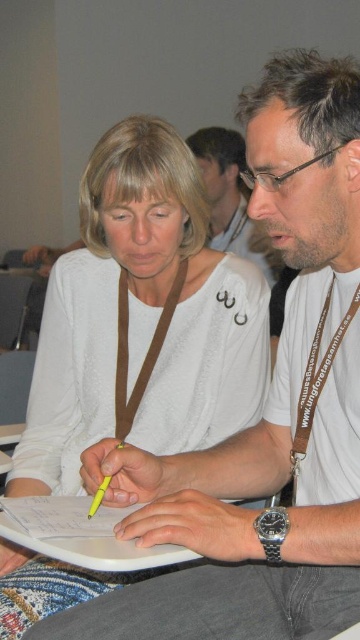
Please describe the exact 2D position of the white matte shirt at upper left in the image coordinate system where the origin is at the bottom left corner of the image, with the x and y axes pointing to the right and up respectively. The coordinates are normalized between 0 and 1. Please provide the coordinates as a tuple of two decimal numbers rounded to three decimal places.

The white matte shirt at upper left is located at the 2D coordinates of approximately point (141, 320).

You are a photographer trying to capture a clear photo of both the white matte shirt at upper left and the matte white shirt at center. Since both are in the same frame, which one should you focus on to ensure it appears sharp in the photo?

You should focus on the white matte shirt at upper left because it is in front of the matte white shirt at center, so focusing on the closer object will keep it sharp while the background may blur slightly.

You are a fashion designer observing two people in the scene. You need to determine which of the two shirts, the white matte shirt at upper left or the matte white shirt at center, has a larger width. Based on the description, which one is wider?

The white matte shirt at upper left has a larger width than the matte white shirt at center as stated in the description.